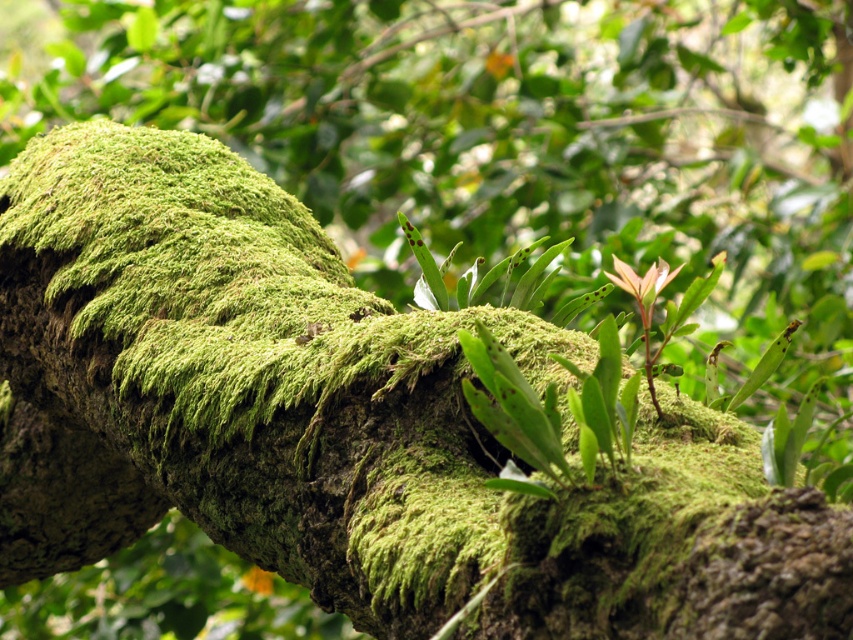
You are a photographer aiming to capture the moss on the branch. You notice two points on the branch labeled as point (666, 284) and point (259, 586). If you want to focus on the part of the branch closest to you, which point should you aim your camera at?

Point (666, 284) is closer to the viewer than point (259, 586), so you should aim your camera at point (666, 284) to focus on the closest part of the branch.

You are an artist sketching the scene. You want to focus on the green leafy plant at center and the green mossy branch at center. Which object should you draw first if you want to emphasize the one that takes up more space in the image?

The green mossy branch at center should be drawn first because it occupies more space than the green leafy plant at center, as stated in the description.